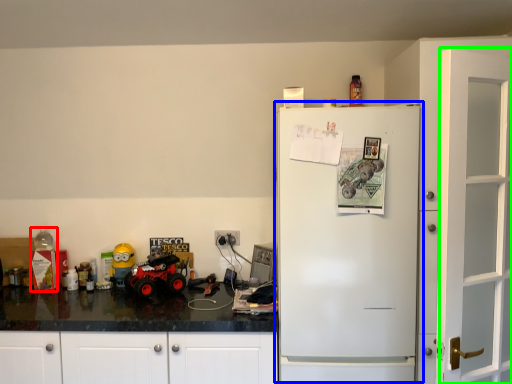
Question: Which object is the closest to the toy (highlighted by a red box)? Choose among these: refrigerator (highlighted by a blue box) or door (highlighted by a green box).

Choices:
 (A) refrigerator
 (B) door

Answer: (A)